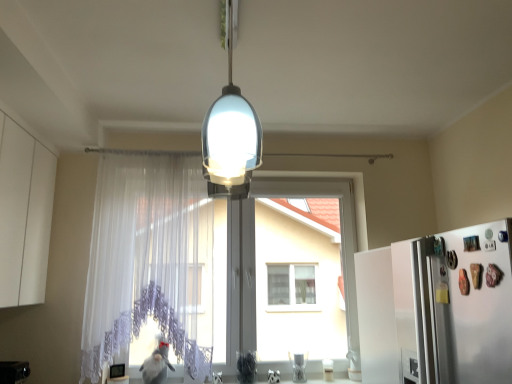
Question: In the image, is white matte refrigerator at right on the left side or the right side of translucent glass lampshade at center?

Choices:
 (A) left
 (B) right

Answer: (B)

Question: Relative to translucent glass lampshade at center, is white matte refrigerator at right in front or behind?

Choices:
 (A) front
 (B) behind

Answer: (B)

Question: Based on their relative distances, which object is nearer to the white matte cabinet at left?

Choices:
 (A) white matte refrigerator at right
 (B) transparent lace curtain at center
 (C) white sheer curtain at center
 (D) translucent glass lampshade at center

Answer: (C)

Question: Estimate the real-world distances between objects in this image. Which object is closer to the white matte cabinet at left?

Choices:
 (A) white sheer curtain at center
 (B) translucent glass lampshade at center
 (C) white matte refrigerator at right
 (D) transparent lace curtain at center

Answer: (A)